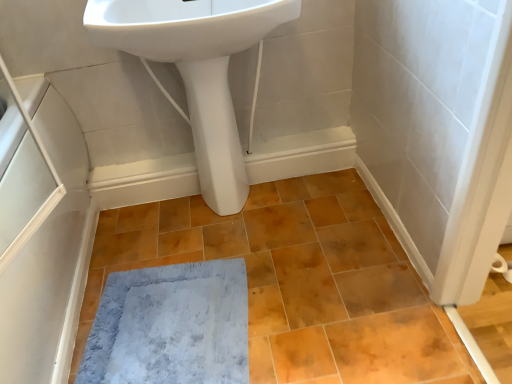
Where is `vacant space to the left of white glossy pedestal at center`? vacant space to the left of white glossy pedestal at center is located at coordinates (181, 217).